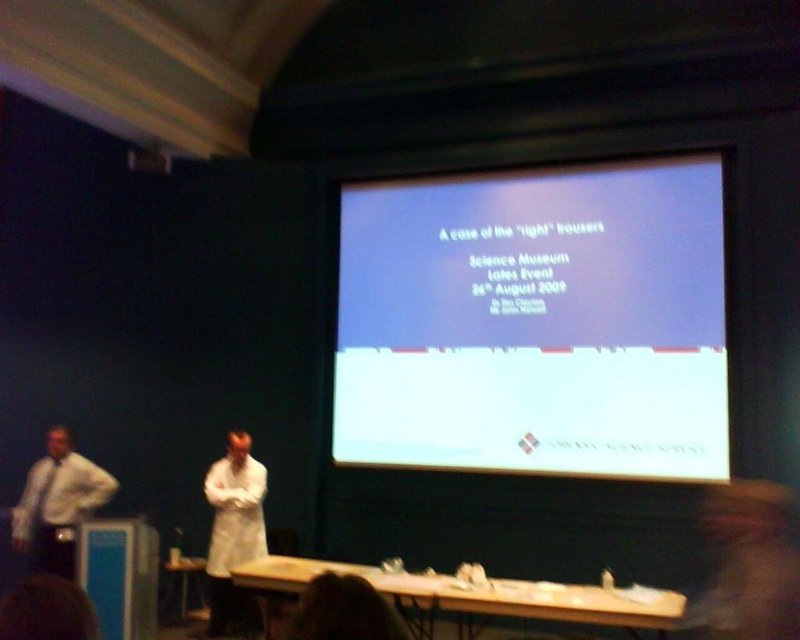
You are attending the Science Museum Talks Event and notice two people at the front. The presenter is wearing a white lab coat at center, and another person is wearing a white shirt at left. From your seat in the audience, which clothing item appears taller?

The white lab coat at center appears taller than the white shirt at left because it has a greater height compared to the white shirt at left.

You are attending the Science Museum Talks Event and notice the white matte projection screen at upper center and the white lab coat at center. From your seat in the audience, which object is positioned more to the right side of the stage?

The white matte projection screen at upper center is positioned more to the right side of the stage compared to the white lab coat at center.